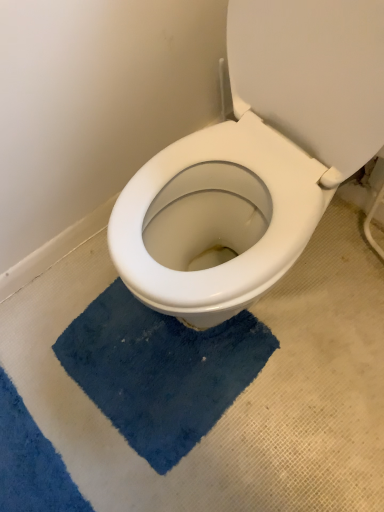
What do you see at coordinates (160, 371) in the screenshot? I see `blue plush bath mat at center` at bounding box center [160, 371].

This screenshot has width=384, height=512. I want to click on blue plush bath mat at center, so click(160, 371).

Image resolution: width=384 pixels, height=512 pixels. I want to click on blue plush bath mat at center, so click(x=160, y=371).